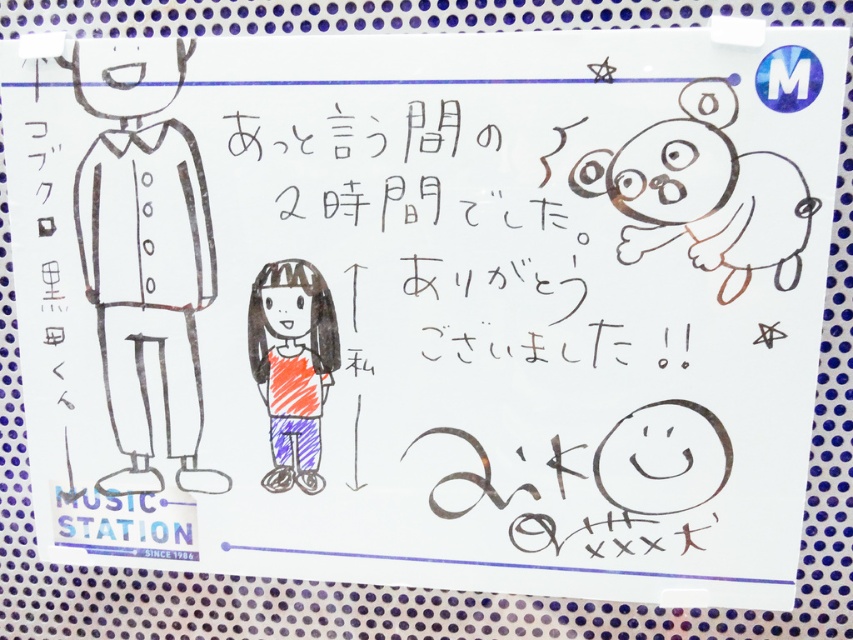
Which is in front, point (196, 380) or point (257, 321)?

Point (257, 321)

Does black line art figure at left appear under orange crayon girl at center?

Actually, black line art figure at left is above orange crayon girl at center.

Between point (215, 474) and point (335, 332), which one is positioned in front?

Point (335, 332)

Locate an element on the screen. This screenshot has height=640, width=853. black line art figure at left is located at coordinates (148, 284).